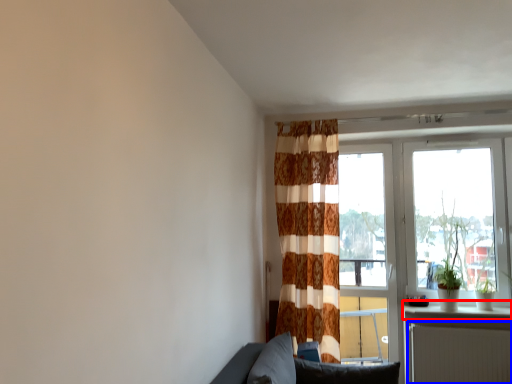
Question: Which of the following is the closest to the observer, window sill (highlighted by a red box) or radiator (highlighted by a blue box)?

Choices:
 (A) window sill
 (B) radiator

Answer: (B)